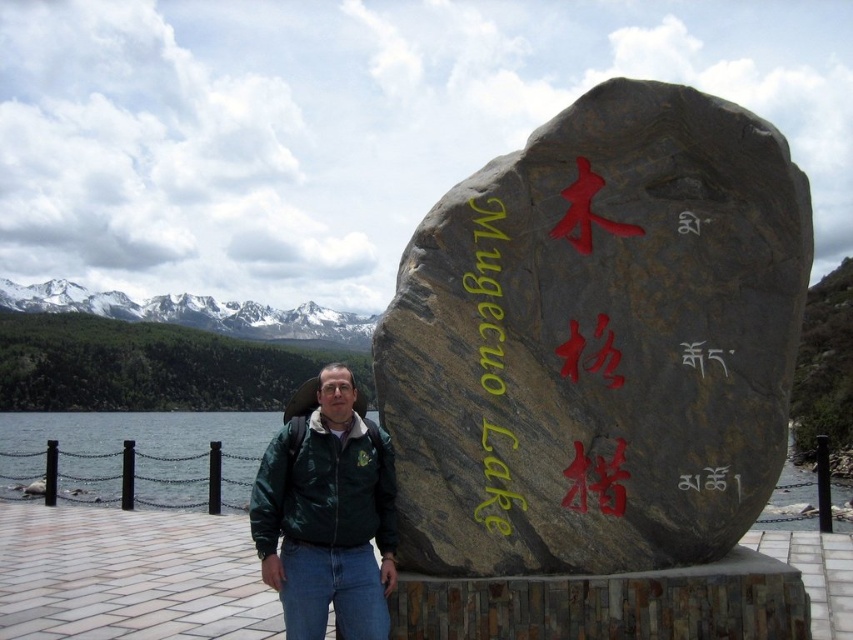
Is brown stone sign at center bigger than clear water at dock left?

No.

Who is lower down, brown stone sign at center or clear water at dock left?

clear water at dock left is below.

Locate an element on the screen. This screenshot has width=853, height=640. brown stone sign at center is located at coordinates (598, 340).

Is green matte jacket at center to the right of clear water at lake right from the viewer's perspective?

Correct, you'll find green matte jacket at center to the right of clear water at lake right.

Identify the location of green matte jacket at center. The image size is (853, 640). (328, 515).

Locate an element on the screen. This screenshot has width=853, height=640. green matte jacket at center is located at coordinates (328, 515).

Can you confirm if green matte jacket at center is wider than clear water at dock left?

No, green matte jacket at center is not wider than clear water at dock left.

Describe the element at coordinates (328, 515) in the screenshot. This screenshot has width=853, height=640. I see `green matte jacket at center` at that location.

Identify the location of green matte jacket at center. (328, 515).